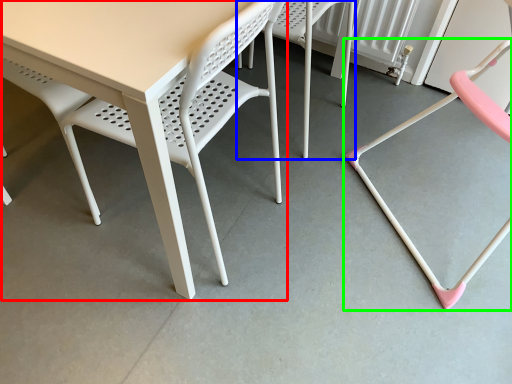
Question: Estimate the real-world distances between objects in this image. Which object is farther from table (highlighted by a red box), chair (highlighted by a blue box) or chair (highlighted by a green box)?

Choices:
 (A) chair
 (B) chair

Answer: (B)